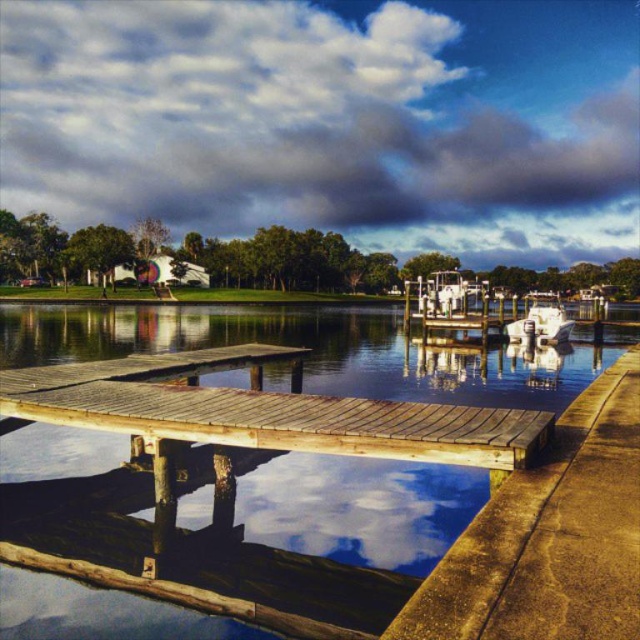
Does smooth wooden dock at center have a greater width compared to weathered wood dock at center?

Yes, smooth wooden dock at center is wider than weathered wood dock at center.

Locate an element on the screen. The width and height of the screenshot is (640, 640). smooth wooden dock at center is located at coordinates (307, 344).

Is point (113, 461) closer to viewer compared to point (544, 422)?

No, it is not.

Where is `smooth wooden dock at center`? smooth wooden dock at center is located at coordinates (307, 344).

Looking at this image, between weathered wood dock at center and white glossy boat at right, which one appears on the left side from the viewer's perspective?

From the viewer's perspective, weathered wood dock at center appears more on the left side.

Who is more forward, (212, 435) or (552, 317)?

Point (212, 435) is more forward.

Where is `weathered wood dock at center`? The height and width of the screenshot is (640, 640). weathered wood dock at center is located at coordinates (292, 420).

Who is more distant from viewer, (536, 396) or (525, 333)?

Positioned behind is point (525, 333).

In the scene shown: Is smooth wooden dock at center closer to camera compared to white glossy boat at right?

Yes, it is.

Which is behind, point (164, 317) or point (557, 312)?

Point (164, 317)

Identify the location of smooth wooden dock at center. This screenshot has height=640, width=640. (307, 344).